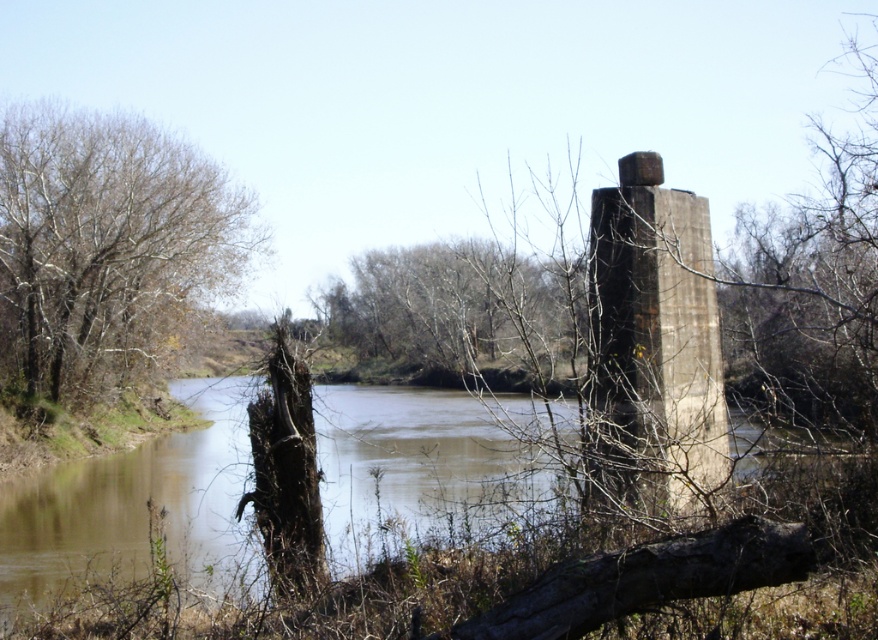
Who is shorter, brown leafless tree at left or bare wood tree at center?

Standing shorter between the two is bare wood tree at center.

Is brown leafless tree at left bigger than bare wood tree at center?

No, brown leafless tree at left is not bigger than bare wood tree at center.

Image resolution: width=878 pixels, height=640 pixels. Find the location of `brown leafless tree at left`. brown leafless tree at left is located at coordinates (106, 248).

Can you confirm if brown leafless tree at left is positioned to the left of concrete/rough pillar at right?

Indeed, brown leafless tree at left is positioned on the left side of concrete/rough pillar at right.

Between brown leafless tree at left and concrete/rough pillar at right, which one is positioned higher?

brown leafless tree at left is higher up.

Find the location of a particular element. Image resolution: width=878 pixels, height=640 pixels. brown leafless tree at left is located at coordinates (106, 248).

Is brown muddy water at center taller than bare wood tree at center?

No.

Who is more forward, (81, 472) or (531, 291)?

Point (531, 291) is in front.

Is point (224, 464) closer to viewer compared to point (576, 326)?

No.

This screenshot has width=878, height=640. Identify the location of brown muddy water at center. (128, 499).